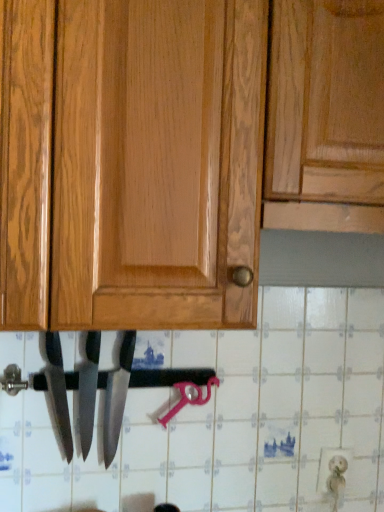
The width and height of the screenshot is (384, 512). I want to click on polished silver knife at center, the first knife positioned from the right, so click(x=117, y=397).

Measure the distance between point (95, 361) and camera.

Point (95, 361) and camera are 35.94 inches apart.

Find the location of a particular element. polished silver knife at center, positioned as the 3th knife in left-to-right order is located at coordinates (117, 397).

Measure the distance from polished silver knife at center, positioned as the 3th knife in left-to-right order, to polished silver knife at center, which is counted as the 2th knife, starting from the right.

4.74 centimeters.

Does polished silver knife at center, the first knife positioned from the right, have a smaller size compared to polished silver knife at center, which is counted as the 2th knife, starting from the right?

Incorrect, polished silver knife at center, the first knife positioned from the right, is not smaller in size than polished silver knife at center, which is counted as the 2th knife, starting from the right.

Is polished silver knife at center, positioned as the 3th knife in left-to-right order, in front of or behind polished silver knife at center, which is the second knife in left-to-right order, in the image?

polished silver knife at center, positioned as the 3th knife in left-to-right order, is in front of polished silver knife at center, which is the second knife in left-to-right order.

Who is shorter, polished silver knife at center, the first knife positioned from the right, or polished silver knife at center, which is the second knife in left-to-right order?

polished silver knife at center, which is the second knife in left-to-right order, is shorter.

Considering the positions of points (64, 439) and (119, 374), is point (64, 439) farther from camera compared to point (119, 374)?

That is False.

Is polished silver knife at lower center, acting as the 1th knife starting from the left, shorter than polished silver knife at center, positioned as the 3th knife in left-to-right order?

Yes.

From the image's perspective, is polished silver knife at lower center, acting as the 1th knife starting from the left, below polished silver knife at center, positioned as the 3th knife in left-to-right order?

Actually, polished silver knife at lower center, acting as the 1th knife starting from the left, appears above polished silver knife at center, positioned as the 3th knife in left-to-right order, in the image.

Is the depth of polished silver knife at lower center, acting as the third knife starting from the right, less than that of polished silver knife at center, which is the second knife in left-to-right order?

Yes, polished silver knife at lower center, acting as the third knife starting from the right, is closer to the viewer.

Is polished silver knife at center, which is the second knife in left-to-right order, at the back of polished silver knife at lower center, acting as the 1th knife starting from the left?

No.

Are polished silver knife at lower center, acting as the third knife starting from the right, and polished silver knife at center, which is counted as the 2th knife, starting from the right, making contact?

Yes, polished silver knife at lower center, acting as the third knife starting from the right, is with polished silver knife at center, which is counted as the 2th knife, starting from the right.

Does polished silver knife at center, the first knife positioned from the right, touch polished silver knife at lower center, acting as the third knife starting from the right?

No, polished silver knife at center, the first knife positioned from the right, is not in contact with polished silver knife at lower center, acting as the third knife starting from the right.

Considering the relative positions of polished silver knife at center, positioned as the 3th knife in left-to-right order, and polished silver knife at lower center, acting as the 1th knife starting from the left, in the image provided, is polished silver knife at center, positioned as the 3th knife in left-to-right order, to the right of polished silver knife at lower center, acting as the 1th knife starting from the left, from the viewer's perspective?

Yes, polished silver knife at center, positioned as the 3th knife in left-to-right order, is to the right of polished silver knife at lower center, acting as the 1th knife starting from the left.

Is point (107, 395) closer to camera compared to point (47, 358)?

No.

Is polished silver knife at center, positioned as the 3th knife in left-to-right order, looking in the opposite direction of polished silver knife at lower center, acting as the third knife starting from the right?

No, polished silver knife at center, positioned as the 3th knife in left-to-right order, is not facing the opposite direction of polished silver knife at lower center, acting as the third knife starting from the right.

Is polished silver knife at center, which is counted as the 2th knife, starting from the right, in contact with polished silver knife at lower center, acting as the third knife starting from the right?

Yes, polished silver knife at center, which is counted as the 2th knife, starting from the right, is next to polished silver knife at lower center, acting as the third knife starting from the right.

Considering the sizes of polished silver knife at center, which is the second knife in left-to-right order, and polished silver knife at lower center, acting as the 1th knife starting from the left, in the image, is polished silver knife at center, which is the second knife in left-to-right order, taller or shorter than polished silver knife at lower center, acting as the 1th knife starting from the left,?

Considering their sizes, polished silver knife at center, which is the second knife in left-to-right order, has more height than polished silver knife at lower center, acting as the 1th knife starting from the left.

From a real-world perspective, between polished silver knife at center, which is the second knife in left-to-right order, and polished silver knife at lower center, acting as the third knife starting from the right, who is vertically higher?

In real-world perspective, polished silver knife at lower center, acting as the third knife starting from the right, is above.

Looking at the image, does polished silver knife at center, which is counted as the 2th knife, starting from the right, seem bigger or smaller compared to polished silver knife at lower center, acting as the third knife starting from the right?

Considering their sizes, polished silver knife at center, which is counted as the 2th knife, starting from the right, takes up less space than polished silver knife at lower center, acting as the third knife starting from the right.

Is polished silver knife at center, which is the second knife in left-to-right order, in front of or behind polished silver knife at center, positioned as the 3th knife in left-to-right order, in the image?

polished silver knife at center, which is the second knife in left-to-right order, is positioned farther from the viewer than polished silver knife at center, positioned as the 3th knife in left-to-right order.

Consider the image. Is polished silver knife at center, positioned as the 3th knife in left-to-right order, surrounded by polished silver knife at center, which is the second knife in left-to-right order?

No, polished silver knife at center, which is the second knife in left-to-right order, does not contain polished silver knife at center, positioned as the 3th knife in left-to-right order.

Which is nearer, (94, 401) or (104, 441)?

Point (94, 401) is closer to the camera than point (104, 441).

From the polished silver knife at center, which is the second knife in left-to-right order, count 1st knifes forward and point to it. Please provide its 2D coordinates.

[(117, 397)]

Find the location of `knife that is the 2nd one when counting downward from the polished silver knife at lower center, acting as the 1th knife starting from the left (from the image's perspective)`. knife that is the 2nd one when counting downward from the polished silver knife at lower center, acting as the 1th knife starting from the left (from the image's perspective) is located at coordinates (117, 397).

Which object lies nearer to the anchor point polished silver knife at center, which is the second knife in left-to-right order, polished silver knife at lower center, acting as the third knife starting from the right, or polished silver knife at center, the first knife positioned from the right?

polished silver knife at center, the first knife positioned from the right, is positioned closer to the anchor polished silver knife at center, which is the second knife in left-to-right order.

When comparing their distances from polished silver knife at center, positioned as the 3th knife in left-to-right order, does polished silver knife at center, which is the second knife in left-to-right order, or polished silver knife at lower center, acting as the 1th knife starting from the left, seem further?

The object further to polished silver knife at center, positioned as the 3th knife in left-to-right order, is polished silver knife at lower center, acting as the 1th knife starting from the left.

Considering their positions, is polished silver knife at center, positioned as the 3th knife in left-to-right order, positioned closer to polished silver knife at center, which is counted as the 2th knife, starting from the right, than polished silver knife at lower center, acting as the 1th knife starting from the left?

The object closer to polished silver knife at center, which is counted as the 2th knife, starting from the right, is polished silver knife at center, positioned as the 3th knife in left-to-right order.

Looking at the image, which one is located further to polished silver knife at center, the first knife positioned from the right, polished silver knife at lower center, acting as the 1th knife starting from the left, or polished silver knife at center, which is counted as the 2th knife, starting from the right?

Based on the image, polished silver knife at lower center, acting as the 1th knife starting from the left, appears to be further to polished silver knife at center, the first knife positioned from the right.

From the image, which object appears to be farther from polished silver knife at lower center, acting as the 1th knife starting from the left, polished silver knife at center, which is the second knife in left-to-right order, or polished silver knife at center, the first knife positioned from the right?

Based on the image, polished silver knife at center, the first knife positioned from the right, appears to be further to polished silver knife at lower center, acting as the 1th knife starting from the left.

Looking at this image, based on their spatial positions, is polished silver knife at center, positioned as the 3th knife in left-to-right order, or polished silver knife at center, which is counted as the 2th knife, starting from the right, further from polished silver knife at lower center, acting as the third knife starting from the right?

polished silver knife at center, positioned as the 3th knife in left-to-right order, is further to polished silver knife at lower center, acting as the third knife starting from the right.

Locate an element on the screen. Image resolution: width=384 pixels, height=512 pixels. knife between polished silver knife at lower center, acting as the 1th knife starting from the left, and polished silver knife at center, the first knife positioned from the right, in the horizontal direction is located at coordinates (88, 386).